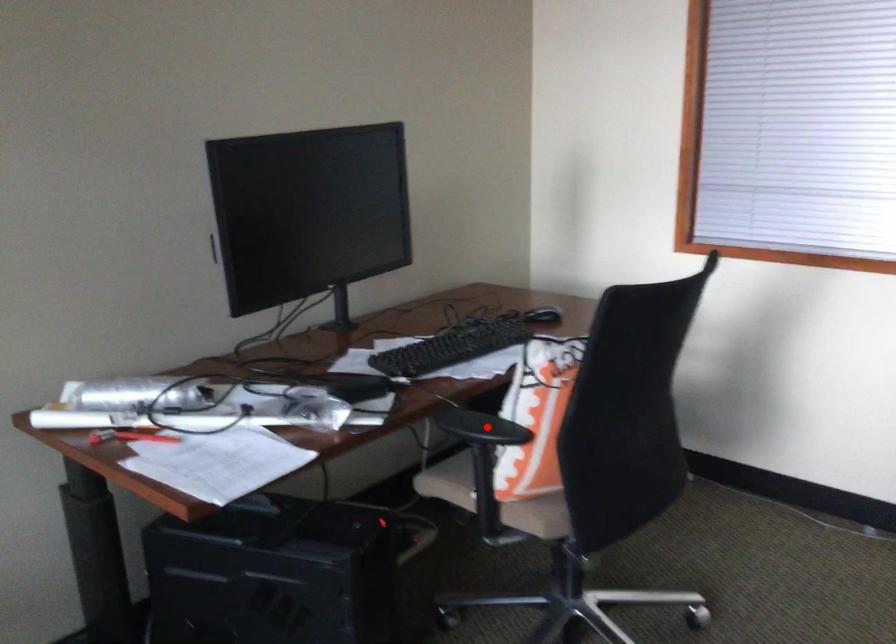
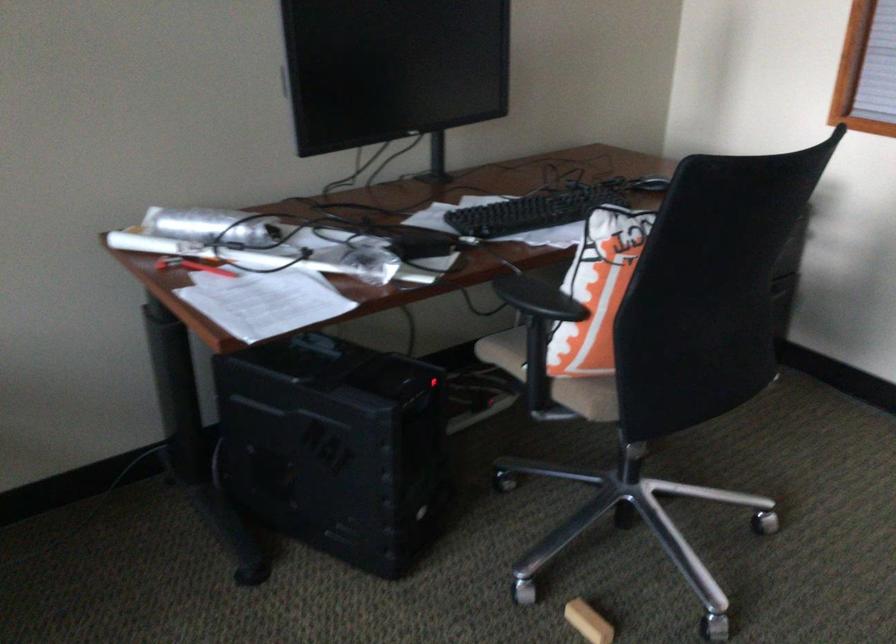
Find the pixel in the second image that matches the highlighted location in the first image.

(538, 299)